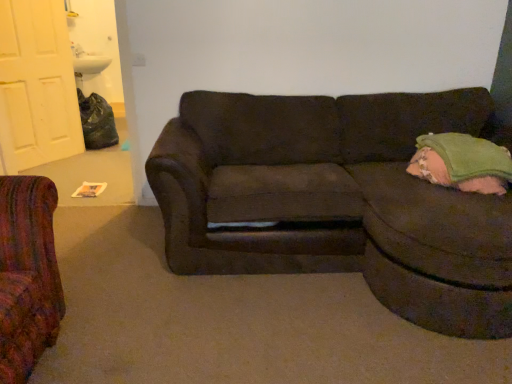
Question: Is green fabric pillow at right to the left of white matte door at upper left from the viewer's perspective?

Choices:
 (A) yes
 (B) no

Answer: (B)

Question: Is green fabric pillow at right bigger than white matte door at upper left?

Choices:
 (A) no
 (B) yes

Answer: (A)

Question: Is the depth of green fabric pillow at right greater than that of white matte door at upper left?

Choices:
 (A) no
 (B) yes

Answer: (A)

Question: Considering the relative sizes of green fabric pillow at right and white matte door at upper left in the image provided, is green fabric pillow at right taller than white matte door at upper left?

Choices:
 (A) no
 (B) yes

Answer: (A)

Question: Is green fabric pillow at right not close to white matte door at upper left?

Choices:
 (A) no
 (B) yes

Answer: (B)

Question: From the image's perspective, is green fabric pillow at right on top of white matte door at upper left?

Choices:
 (A) no
 (B) yes

Answer: (A)

Question: Is green fabric pillow at right facing towards dark brown fabric couch at center?

Choices:
 (A) no
 (B) yes

Answer: (B)

Question: Can you confirm if green fabric pillow at right is taller than dark brown fabric couch at center?

Choices:
 (A) yes
 (B) no

Answer: (B)

Question: Is green fabric pillow at right shorter than dark brown fabric couch at center?

Choices:
 (A) no
 (B) yes

Answer: (B)

Question: Considering the relative positions of green fabric pillow at right and dark brown fabric couch at center in the image provided, is green fabric pillow at right to the left of dark brown fabric couch at center from the viewer's perspective?

Choices:
 (A) yes
 (B) no

Answer: (B)

Question: Considering the relative sizes of green fabric pillow at right and dark brown fabric couch at center in the image provided, is green fabric pillow at right thinner than dark brown fabric couch at center?

Choices:
 (A) no
 (B) yes

Answer: (B)

Question: From the image's perspective, would you say green fabric pillow at right is positioned over dark brown fabric couch at center?

Choices:
 (A) no
 (B) yes

Answer: (B)

Question: Is dark brown fabric couch at center far away from white matte door at upper left?

Choices:
 (A) no
 (B) yes

Answer: (B)